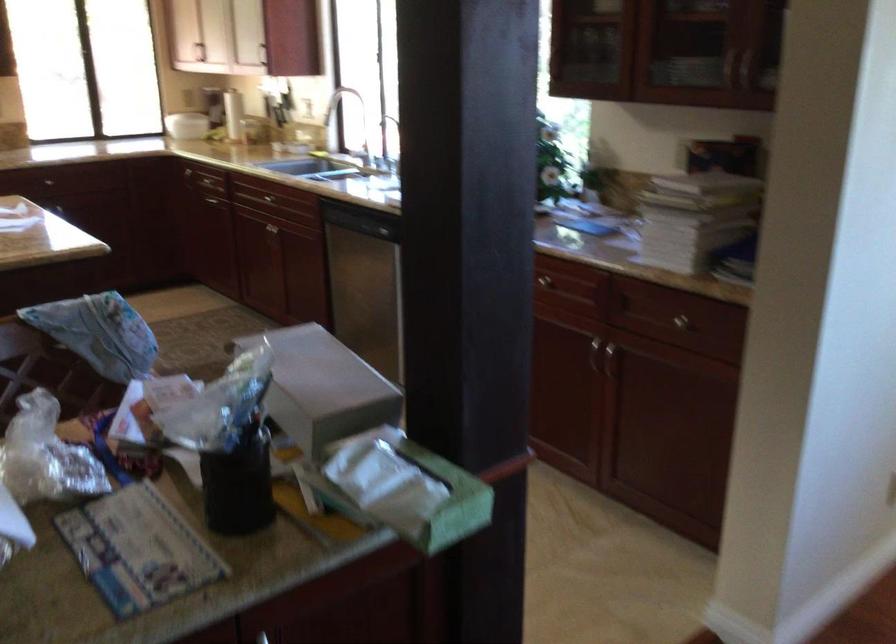
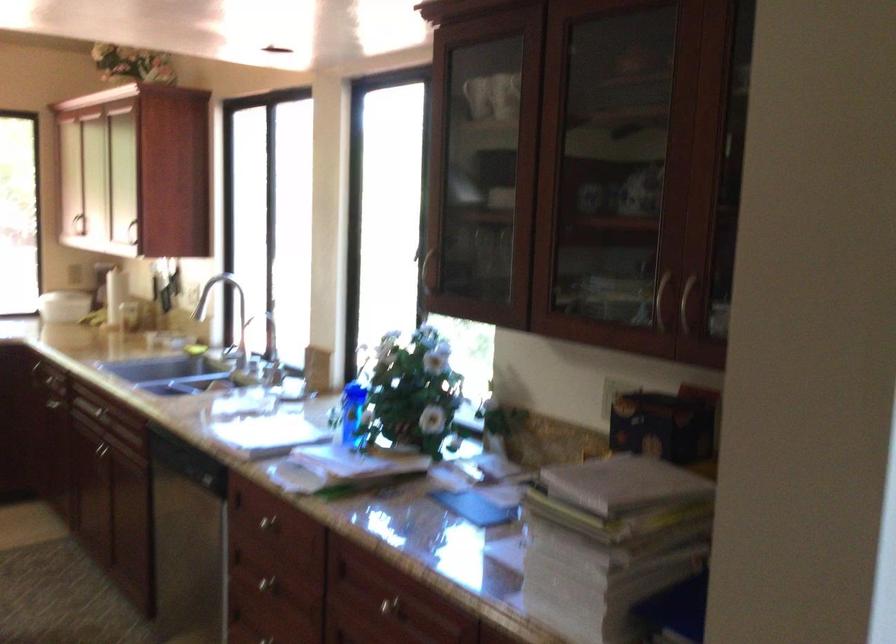
From the picture: What movement of the cameraman would produce the second image?

The cameraman walked toward right, forward.